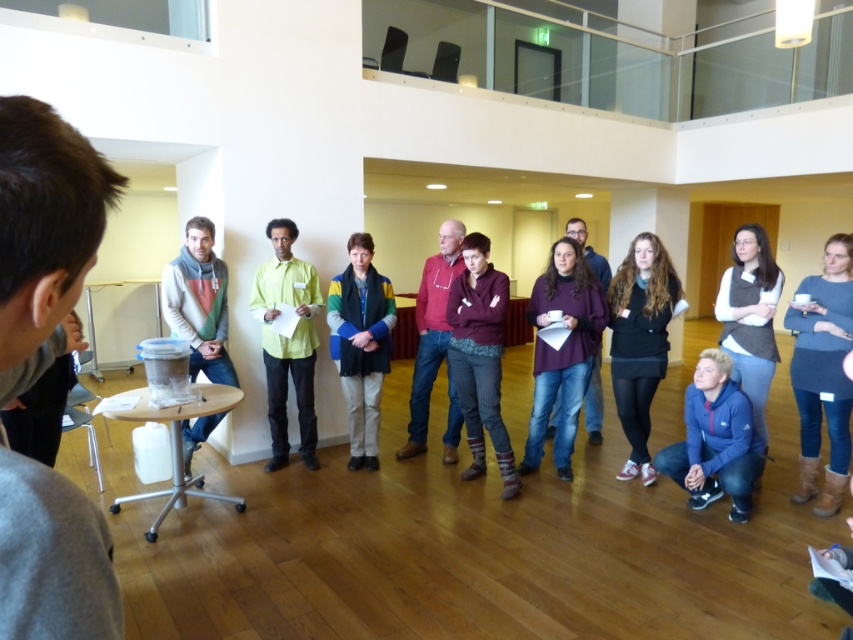
Question: Estimate the real-world distances between objects in this image. Which object is closer to the purple sweater at center?

Choices:
 (A) black knit sweater at center
 (B) gray fleece sweater at center

Answer: (A)

Question: Can you confirm if dark gray sweater at center is thinner than gray fleece sweater at center?

Choices:
 (A) yes
 (B) no

Answer: (A)

Question: Does dark gray sweater at center have a smaller size compared to matte red hoodie at center?

Choices:
 (A) no
 (B) yes

Answer: (B)

Question: Is dark gray sweater at center above multicolored fabric jacket at center?

Choices:
 (A) yes
 (B) no

Answer: (B)

Question: Which point appears farthest from the camera in this image?

Choices:
 (A) (445, 340)
 (B) (195, 312)
 (C) (364, 456)

Answer: (C)

Question: Which point appears farthest from the camera in this image?

Choices:
 (A) (349, 280)
 (B) (421, 284)
 (C) (311, 308)

Answer: (B)